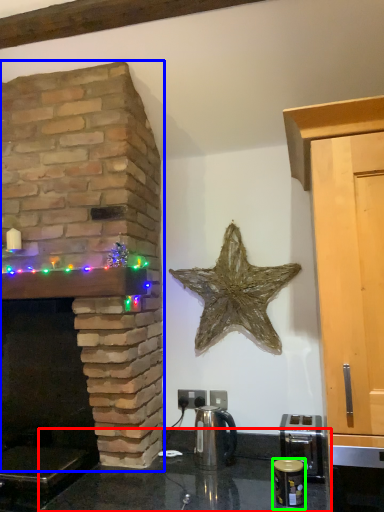
Question: Considering the real-world distances, which object is closest to counter top (highlighted by a red box)? fireplace (highlighted by a blue box) or appliance (highlighted by a green box).

Choices:
 (A) fireplace
 (B) appliance

Answer: (B)